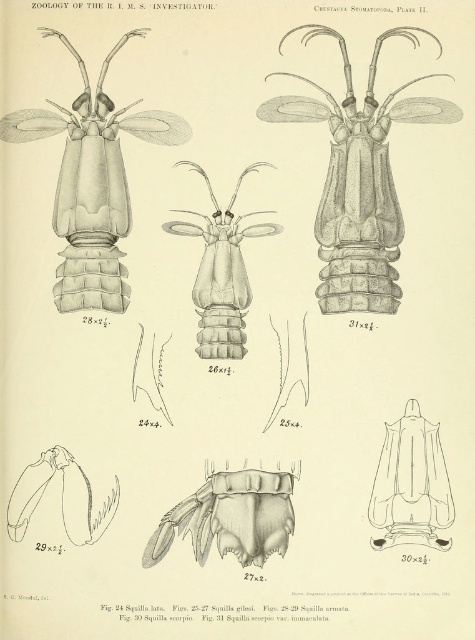
Does grayish-brown exoskeleton at center have a smaller size compared to translucent gray exoskeleton at center?

No.

Who is more distant from viewer, (363, 253) or (207, 518)?

Positioned behind is point (363, 253).

Locate an element on the screen. The image size is (475, 640). grayish-brown exoskeleton at center is located at coordinates (359, 179).

Who is more forward, (x=333, y=33) or (x=53, y=216)?

Point (x=333, y=33) is more forward.

Can you confirm if grayish-brown exoskeleton at center is positioned to the left of matte gray crustacean at upper left?

No, grayish-brown exoskeleton at center is not to the left of matte gray crustacean at upper left.

The image size is (475, 640). Describe the element at coordinates (359, 179) in the screenshot. I see `grayish-brown exoskeleton at center` at that location.

This screenshot has width=475, height=640. Find the location of `grayish-brown exoskeleton at center`. grayish-brown exoskeleton at center is located at coordinates (359, 179).

Which is in front, point (383, 499) or point (227, 314)?

Point (383, 499) is more forward.

Is transparent plastic scorpion at lower right closer to camera compared to transparent glass insect at center?

Yes, it is in front of transparent glass insect at center.

Who is more distant from viewer, (x=429, y=474) or (x=225, y=248)?

The point (x=225, y=248) is behind.

Find the location of a particular element. The height and width of the screenshot is (640, 475). transparent plastic scorpion at lower right is located at coordinates (410, 484).